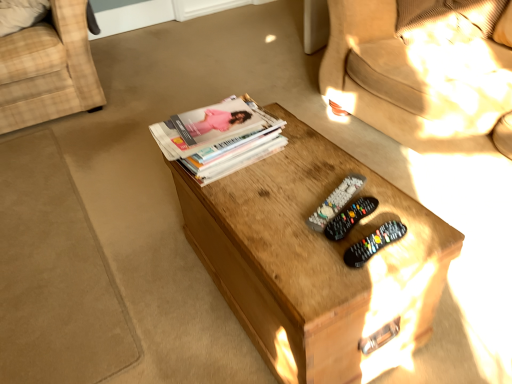
Locate an element on the screen. free space behind black plastic remote at center, which is the 3th remote control from front to back is located at coordinates (315, 167).